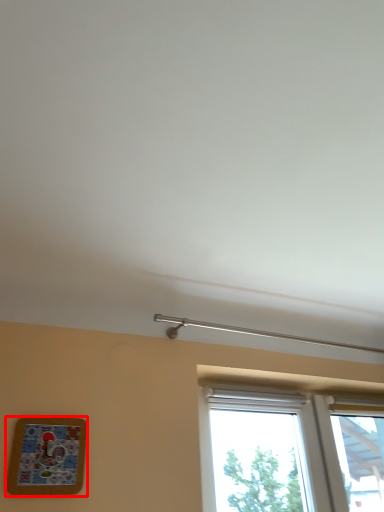
Question: From the image's perspective, where is picture frame (annotated by the red box) located in relation to window in the image?

Choices:
 (A) above
 (B) below

Answer: (A)